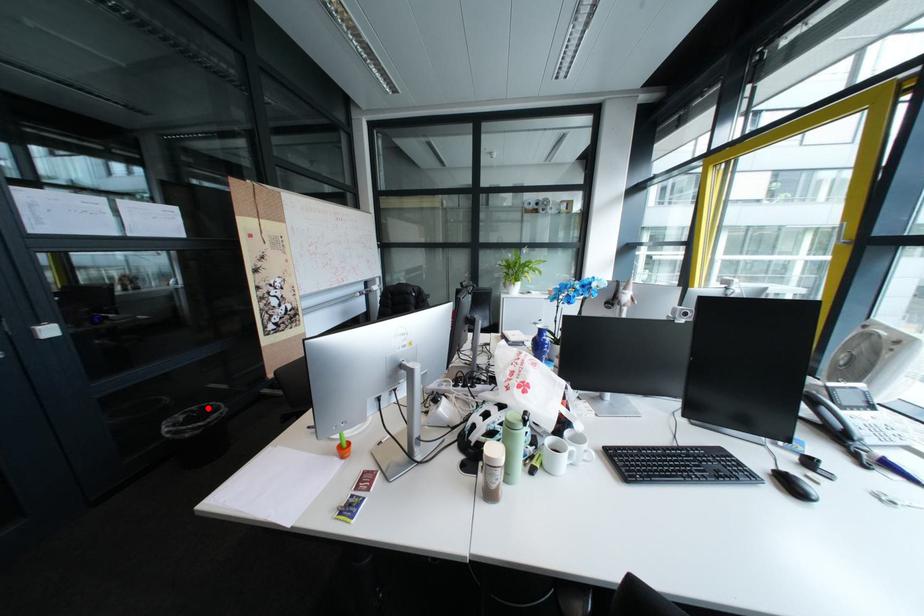
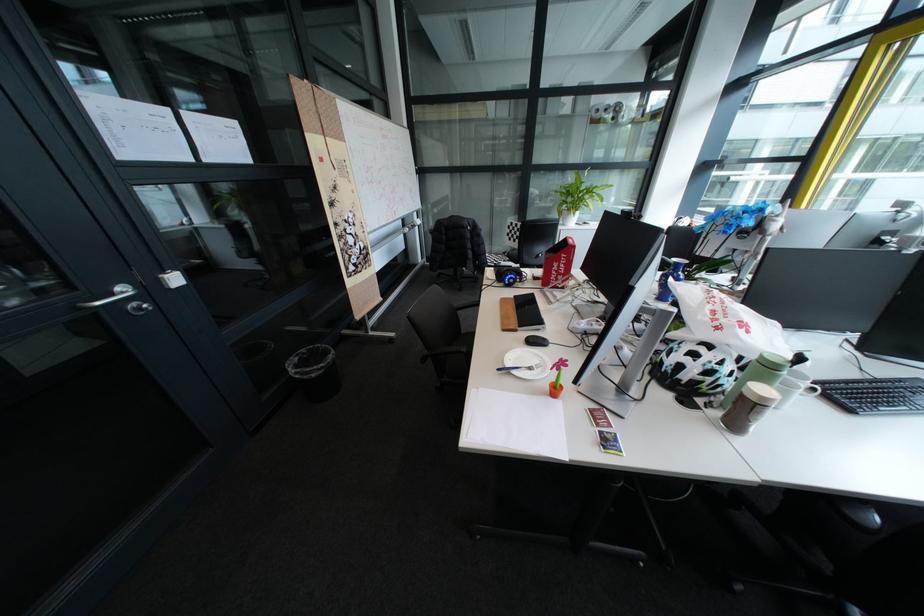
Where in the second image is the point corresponding to the highlighted location from the first image?

(317, 351)